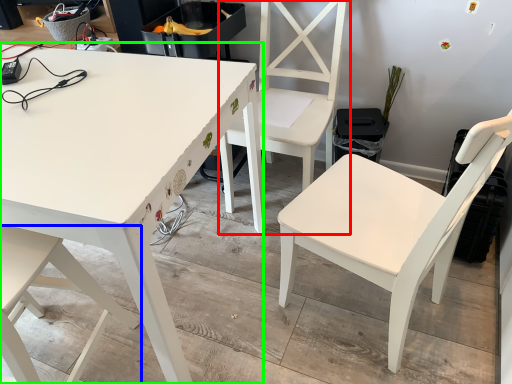
Question: Which object is the farthest from chair (highlighted by a red box)? Choose among these: chair (highlighted by a blue box) or table (highlighted by a green box).

Choices:
 (A) chair
 (B) table

Answer: (A)